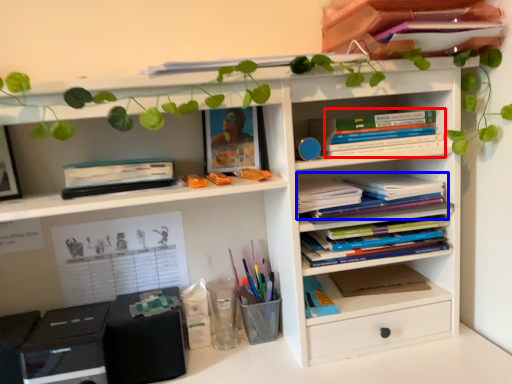
Question: Among these objects, which one is nearest to the camera, book (highlighted by a red box) or book (highlighted by a blue box)?

Choices:
 (A) book
 (B) book

Answer: (A)